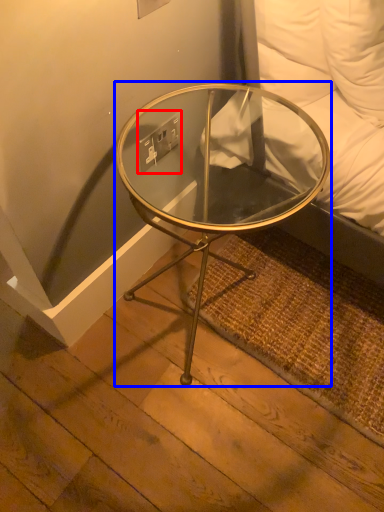
Question: Which object is closer to the camera taking this photo, electric outlet (highlighted by a red box) or coffee table (highlighted by a blue box)?

Choices:
 (A) electric outlet
 (B) coffee table

Answer: (B)